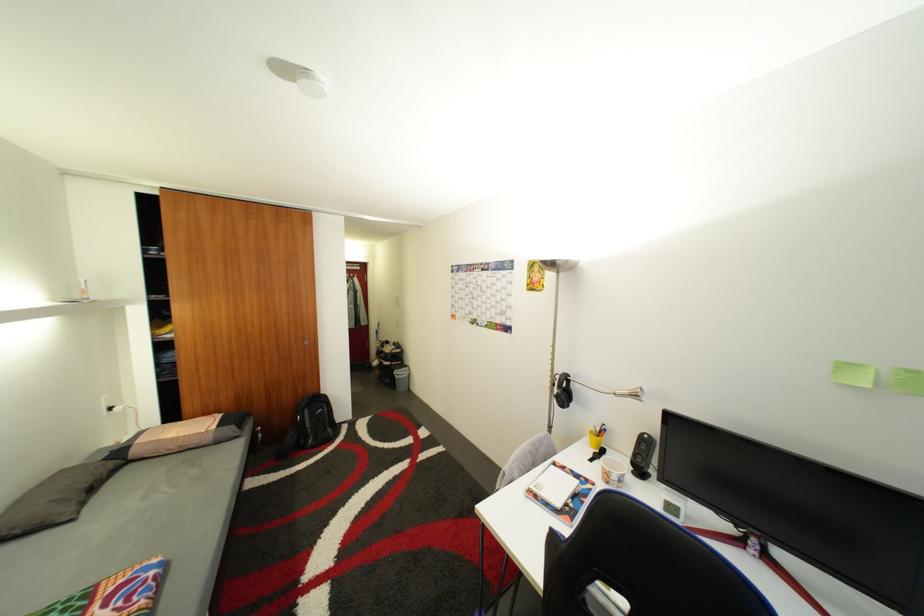
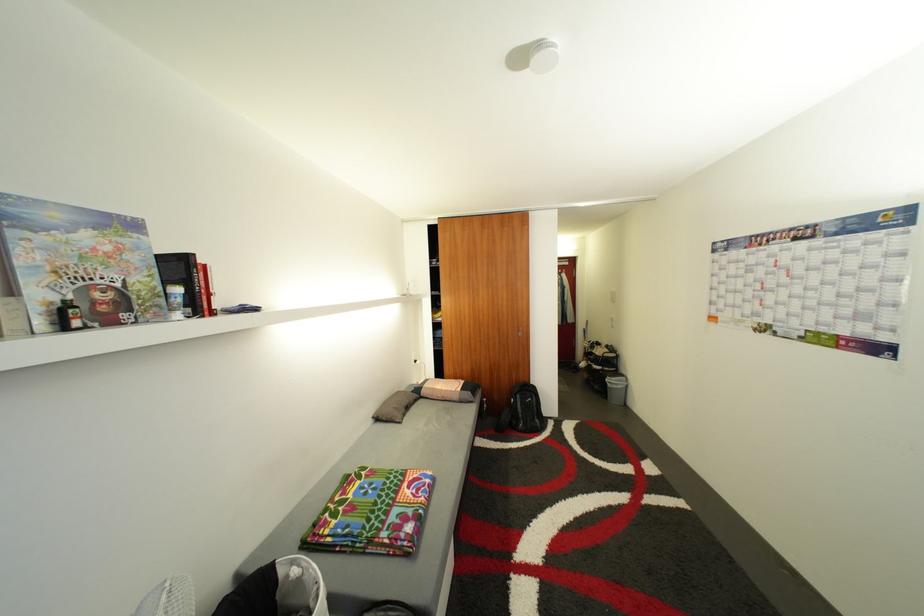
Question: The images are taken continuously from a first-person perspective. In which direction is your viewpoint rotating?

Choices:
 (A) Left
 (B) Right
 (C) Up
 (D) Down

Answer: (A)